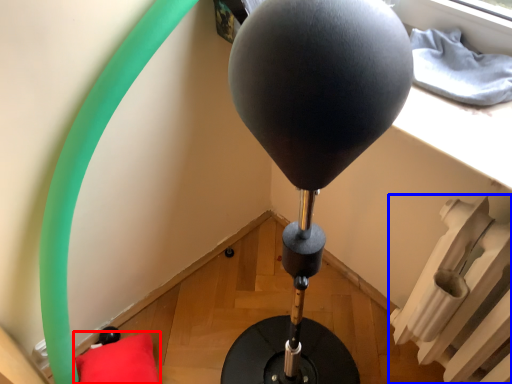
Question: Which object appears farthest to the camera in this image, pillow (highlighted by a red box) or radiator (highlighted by a blue box)?

Choices:
 (A) pillow
 (B) radiator

Answer: (A)